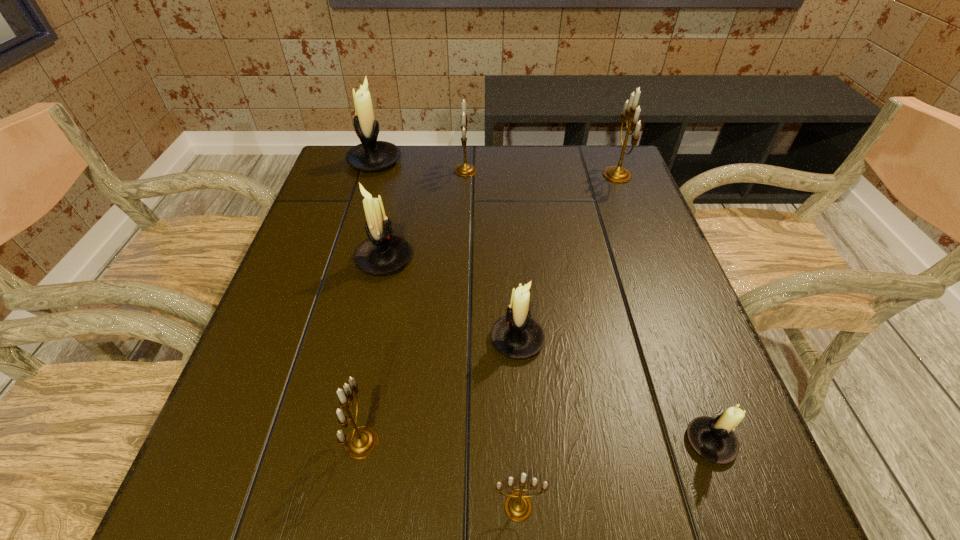
In order to click on vacant space located 0.180m on the back of the nearest white candle holder in this screenshot , I will do `click(670, 333)`.

Locate an element on the screen. This screenshot has width=960, height=540. free region located on the left of the nearest object is located at coordinates (337, 507).

Find the location of `object at the far left corner`. object at the far left corner is located at coordinates (370, 155).

Find the location of a particular element. object that is at the far right corner is located at coordinates (617, 174).

This screenshot has height=540, width=960. I want to click on vacant space at the far edge of the desktop, so click(x=514, y=169).

Identify the location of free location at the left edge. (329, 273).

The image size is (960, 540). Find the location of `free space at the right edge of the desktop`. free space at the right edge of the desktop is located at coordinates (669, 370).

In the image, there is a desktop. Where is `vacant space at the far left corner`? vacant space at the far left corner is located at coordinates (321, 188).

Locate an element on the screen. This screenshot has width=960, height=540. free spot between the biggest white candle holder and the third gold candelabrum from right to left is located at coordinates (420, 166).

Locate an element on the screen. The width and height of the screenshot is (960, 540). vacant point located between the rightmost white candle holder and the third smallest white candle holder is located at coordinates (547, 350).